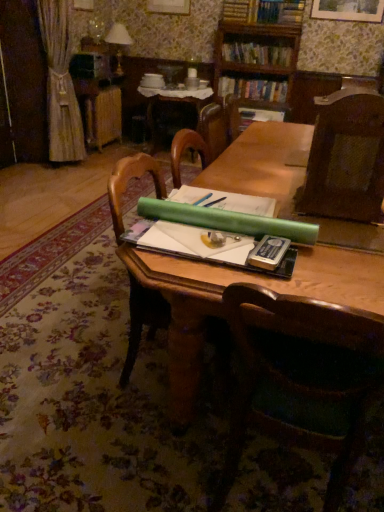
Locate an element on the screen. free point in front of metallic silver paperback book at center is located at coordinates (295, 281).